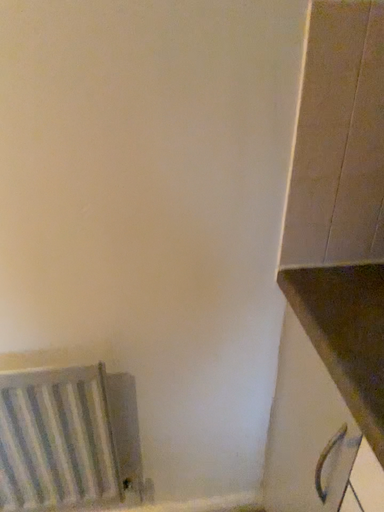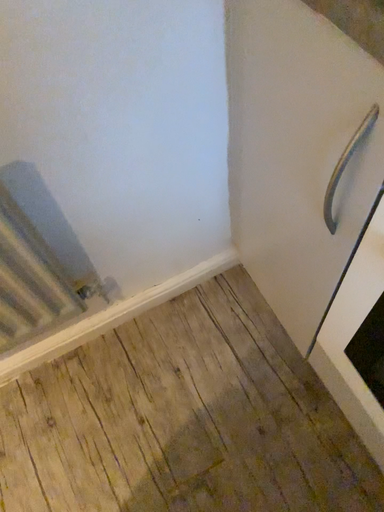
Question: Which way did the camera rotate in the video?

Choices:
 (A) rotated upward
 (B) rotated downward

Answer: (B)